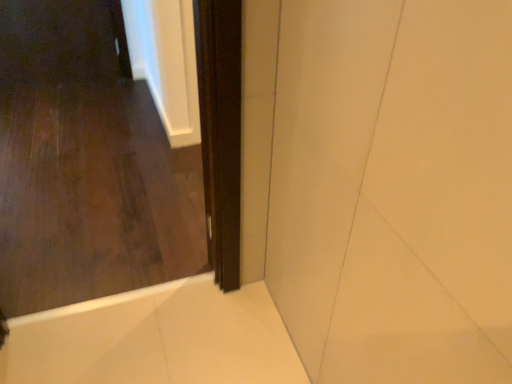
Where is `vacant space to the right of dark wood door at center`? The width and height of the screenshot is (512, 384). vacant space to the right of dark wood door at center is located at coordinates pos(205,332).